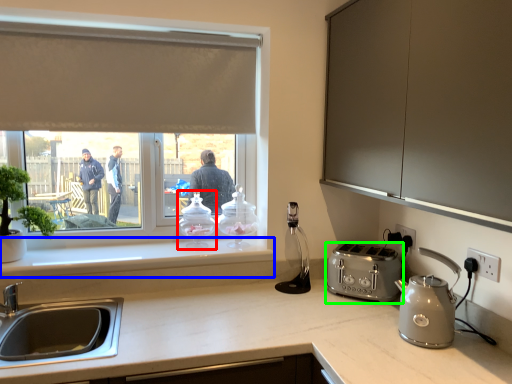
Question: Considering the real-world distances, which object is closest to kitchen appliance (highlighted by a red box)? window sill (highlighted by a blue box) or toaster (highlighted by a green box).

Choices:
 (A) window sill
 (B) toaster

Answer: (A)